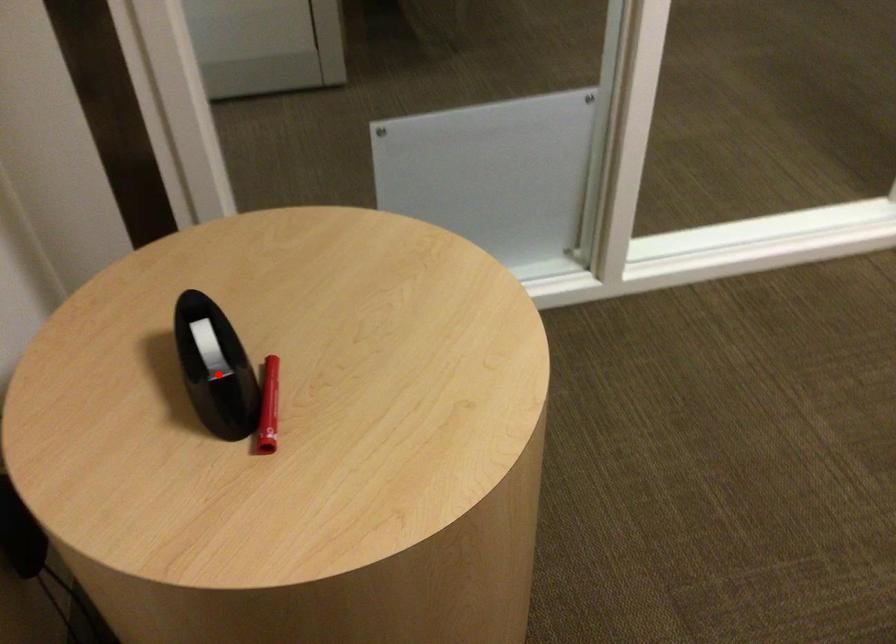
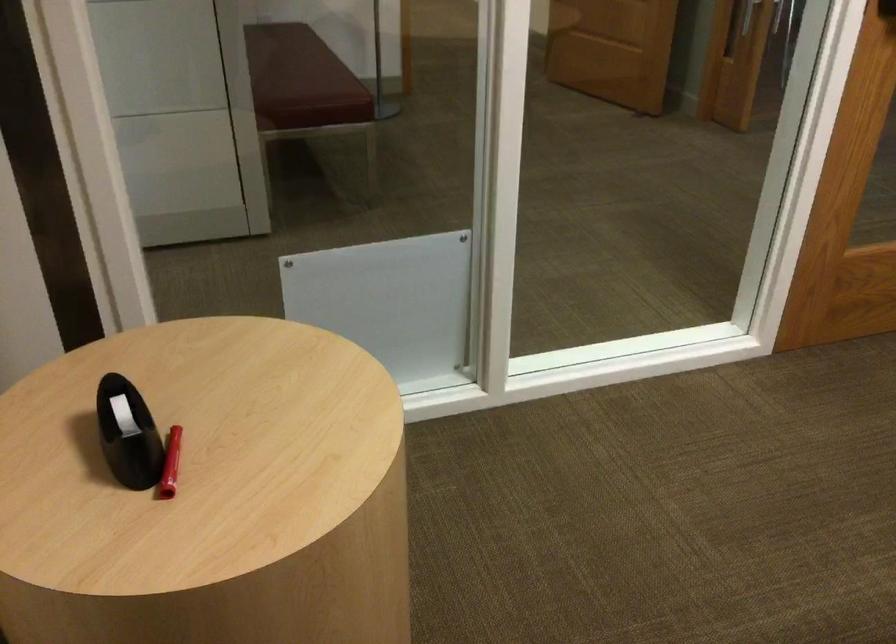
The point at the highlighted location is marked in the first image. Where is the corresponding point in the second image?

(127, 433)